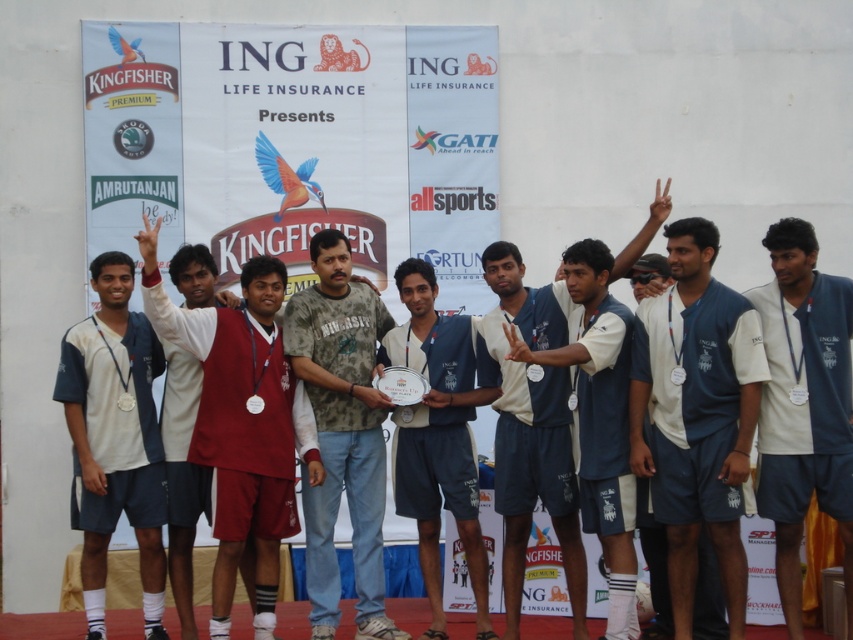
Which is below, white matte shirt at center or camouflage fabric shirt at center?

white matte shirt at center is below.

Is point (782, 392) positioned after point (366, 550)?

No, it is not.

The width and height of the screenshot is (853, 640). What are the coordinates of `white matte shirt at center` in the screenshot? It's located at (804, 404).

Who is more distant from viewer, [805,365] or [433,387]?

The point [433,387] is more distant.

Is white matte shirt at center to the left of blue fabric shirt at center from the viewer's perspective?

In fact, white matte shirt at center is to the right of blue fabric shirt at center.

Does point (796, 380) come farther from viewer compared to point (432, 481)?

No.

You are a GUI agent. You are given a task and a screenshot of the screen. Output one action in this format:
    pyautogui.click(x=<x>, y=<y>)
    Task: Click on the white matte shirt at center
    
    Given the screenshot: What is the action you would take?
    pyautogui.click(x=804, y=404)

Is point (712, 406) behind point (144, 381)?

That is False.

How much distance is there between white fabric shirt at center and white matte jersey at center?

17.06 meters

Locate an element on the screen. white fabric shirt at center is located at coordinates (695, 416).

Where is `white fabric shirt at center`? white fabric shirt at center is located at coordinates (695, 416).